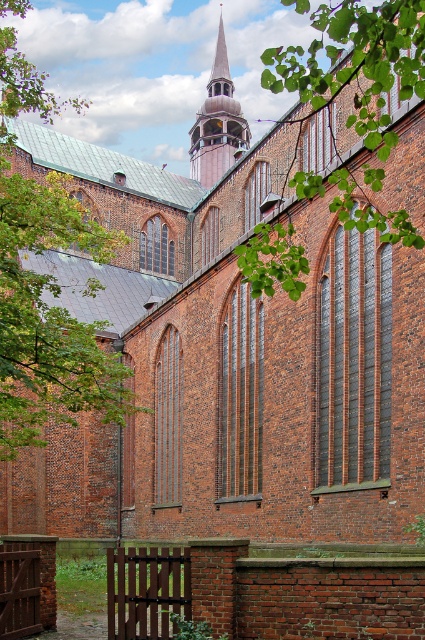
Can you confirm if green leafy tree at left is smaller than wooden spire at center?

Incorrect, green leafy tree at left is not smaller in size than wooden spire at center.

This screenshot has width=425, height=640. Describe the element at coordinates (45, 284) in the screenshot. I see `green leafy tree at left` at that location.

Where is `green leafy tree at left`? The image size is (425, 640). green leafy tree at left is located at coordinates (45, 284).

Is point (17, 252) in front of point (283, 280)?

No, (17, 252) is behind (283, 280).

Who is more forward, [22,429] or [380,131]?

Positioned in front is point [380,131].

Find the location of a particular element. Image resolution: width=425 pixels, height=640 pixels. green leafy tree at left is located at coordinates (45, 284).

Measure the distance between green leafy branch at upper center and wooden spire at center.

The distance of green leafy branch at upper center from wooden spire at center is 34.73 meters.

Is green leafy branch at upper center in front of wooden spire at center?

Yes, it is in front of wooden spire at center.

Does point (362, 129) lie in front of point (220, 118)?

Yes, point (362, 129) is closer to viewer.

Where is `green leafy branch at upper center`? green leafy branch at upper center is located at coordinates (356, 67).